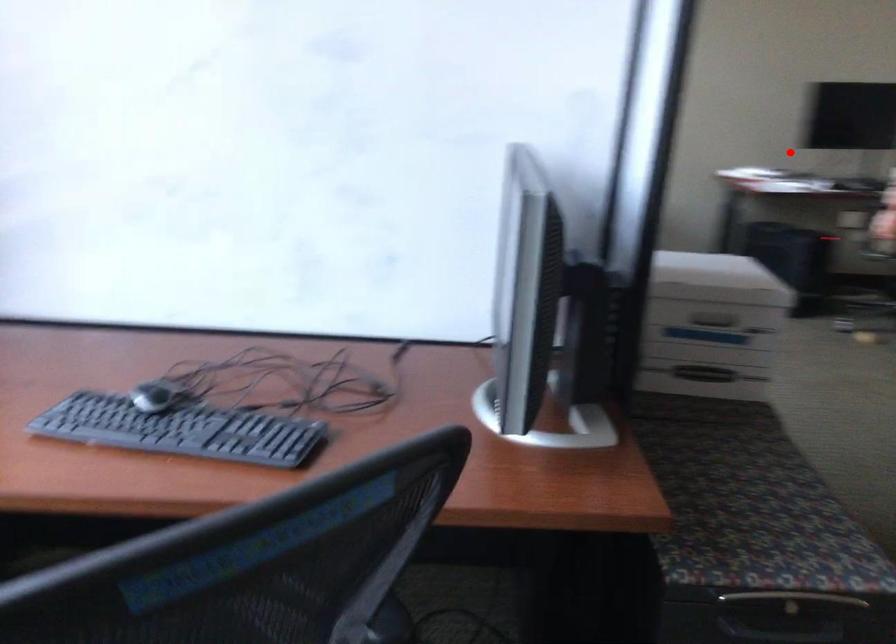
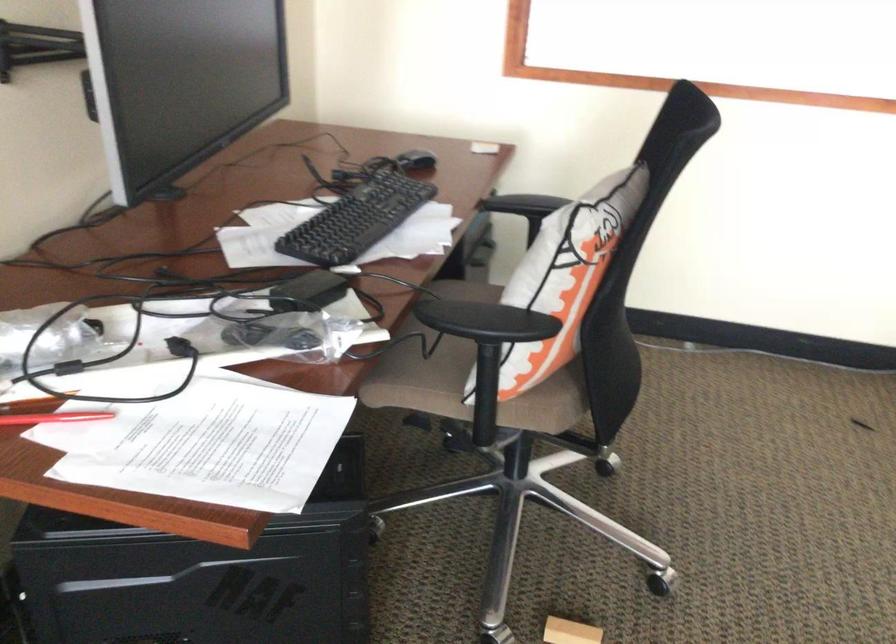
Find the pixel in the second image that matches the highlighted location in the first image.

(54, 418)